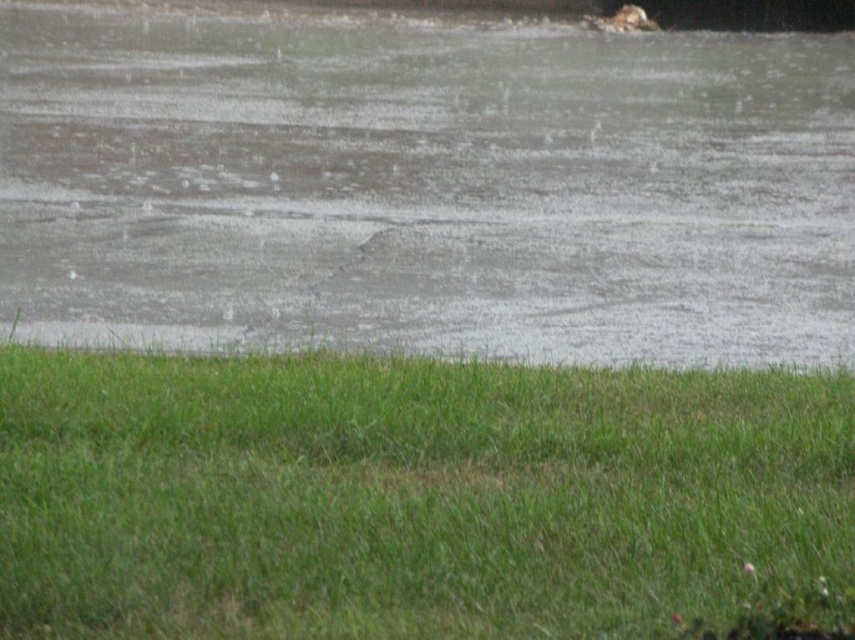
You are standing at the edge of the scene and want to step onto the green grass at lower center. Which direction should you move relative to the gray matte water at center?

You should move to the right side of the gray matte water at center to reach the green grass at lower center because the gray matte water at center is positioned on the left side of green grass at lower center.

Based on the photo, you are standing at the edge of the scene and want to step onto the green grass at lower center. Based on the spatial arrangement, which direction should you move relative to the gray matte water at center?

Since the gray matte water at center is located above the green grass at lower center, you should move downward towards the green grass at lower center to reach it.